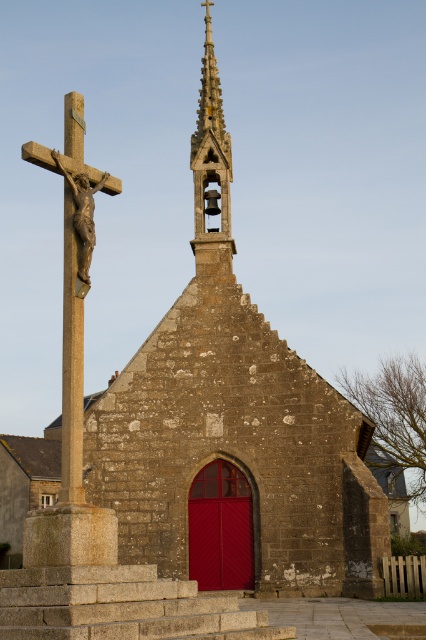
Question: Does smooth stone spire at upper center have a lesser width compared to polished bronze crucifix at left?

Choices:
 (A) yes
 (B) no

Answer: (B)

Question: Can you confirm if smooth stone spire at upper center is positioned to the right of polished bronze crucifix at left?

Choices:
 (A) yes
 (B) no

Answer: (A)

Question: Can you confirm if smooth stone spire at upper center is positioned to the left of polished bronze crucifix at left?

Choices:
 (A) yes
 (B) no

Answer: (B)